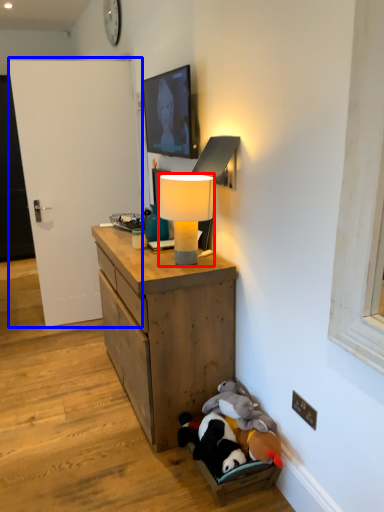
Question: Among these objects, which one is nearest to the camera, lamp (highlighted by a red box) or door (highlighted by a blue box)?

Choices:
 (A) lamp
 (B) door

Answer: (A)